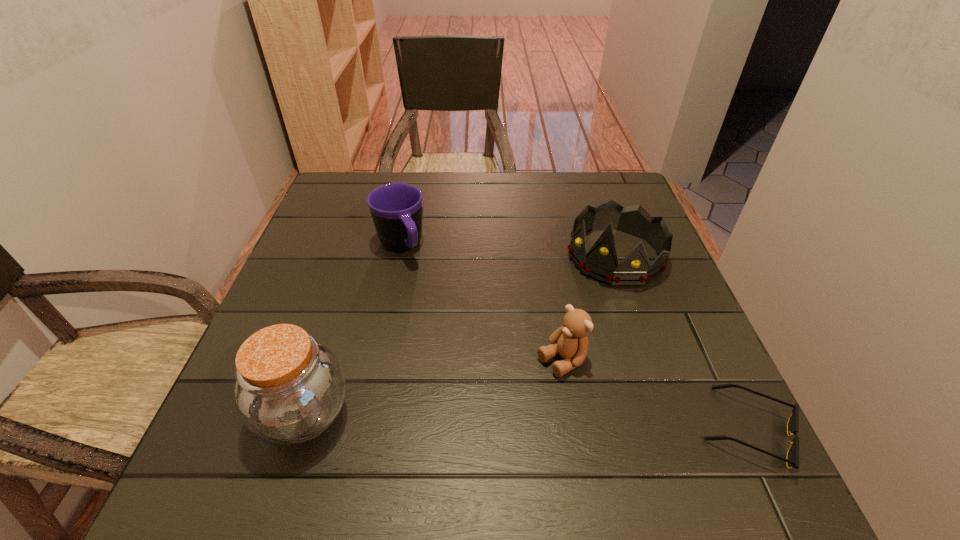
Locate an element on the screen. The width and height of the screenshot is (960, 540). jar is located at coordinates (289, 389).

You are a GUI agent. You are given a task and a screenshot of the screen. Output one action in this format:
    pyautogui.click(x=<x>, y=<y>)
    Task: Click on the shortest object
    
    Given the screenshot: What is the action you would take?
    pyautogui.click(x=792, y=460)

Where is `tiara`? The image size is (960, 540). tiara is located at coordinates (600, 263).

Where is `the third object from left to right`? the third object from left to right is located at coordinates (570, 341).

Find the location of a particular element. The image size is (960, 540). mug is located at coordinates [396, 208].

Find the location of a particular element. vacant area located on the right of the jar is located at coordinates (461, 414).

The image size is (960, 540). In order to click on vacant region located 0.360m at the front of the tiara with jewels in this screenshot , I will do `click(515, 397)`.

Locate an element on the screen. The width and height of the screenshot is (960, 540). vacant space located 0.320m at the front of the tiara with jewels is located at coordinates (525, 382).

At what (x,y) coordinates should I click in order to perform the action: click on free space located at the front of the tiara with jewels. Please return your answer as a coordinate pair (x, y). This screenshot has height=540, width=960. Looking at the image, I should click on (536, 367).

I want to click on vacant space located 0.170m on the front-facing side of the teddy bear, so click(x=468, y=418).